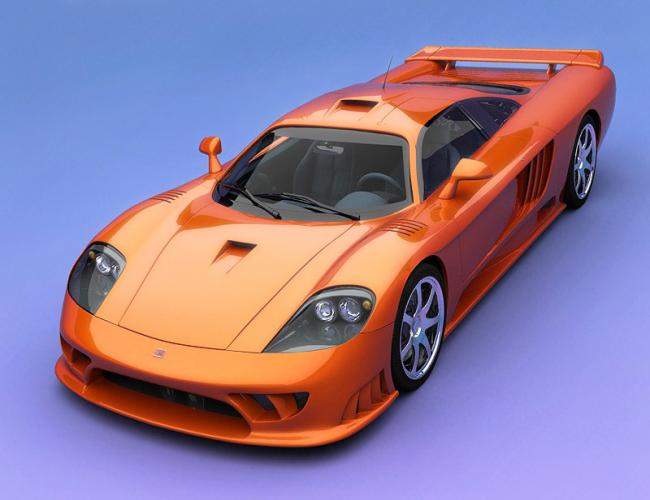
Identify the location of vents. (177, 192), (402, 224).